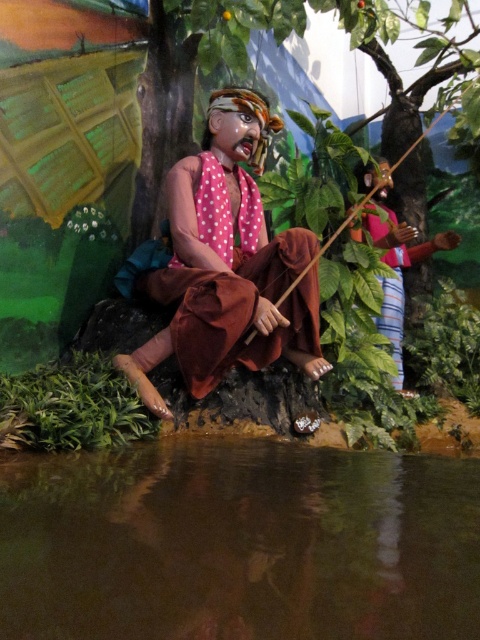
Question: Can you confirm if transparent liquid water at lower center is bigger than polka dot fabric shirt at upper right?

Choices:
 (A) yes
 (B) no

Answer: (B)

Question: Which point is farther to the camera?

Choices:
 (A) (451, 234)
 (B) (275, 320)

Answer: (A)

Question: Which point is farther to the camera?

Choices:
 (A) (241, 358)
 (B) (350, 230)
 (C) (452, 534)

Answer: (B)

Question: Is matte brown cloth at center behind polka dot fabric shirt at upper right?

Choices:
 (A) no
 (B) yes

Answer: (A)

Question: Does matte brown cloth at center appear on the right side of polka dot fabric shirt at upper right?

Choices:
 (A) no
 (B) yes

Answer: (A)

Question: Based on their relative distances, which object is farther from the matte brown cloth at center?

Choices:
 (A) polka dot fabric shirt at upper right
 (B) transparent liquid water at lower center

Answer: (A)